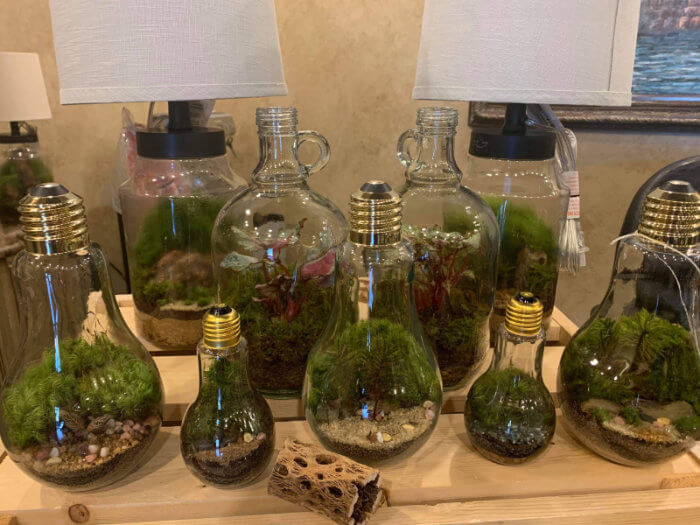
You are a GUI agent. You are given a task and a screenshot of the screen. Output one action in this format:
    pyautogui.click(x=<x>, y=<y>)
    Task: Click on the wall
    Image resolution: width=700 pixels, height=525 pixels.
    Given the screenshot: What is the action you would take?
    pyautogui.click(x=370, y=52)